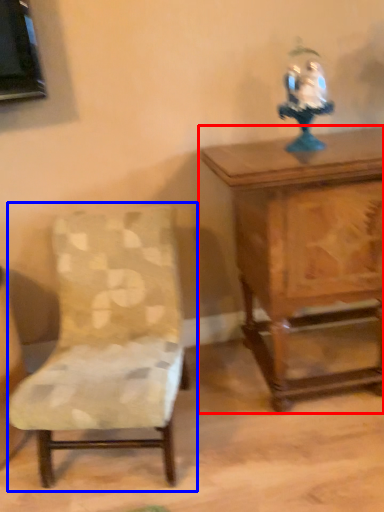
Question: Among these objects, which one is nearest to the camera, table (highlighted by a red box) or chair (highlighted by a blue box)?

Choices:
 (A) table
 (B) chair

Answer: (B)